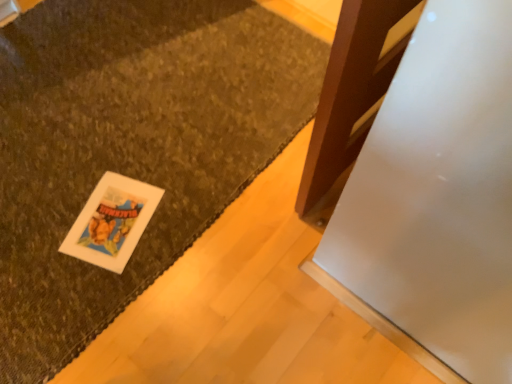
Question: Looking at the image, does white matte card at lower left seem bigger or smaller compared to textured brown mat at lower left?

Choices:
 (A) big
 (B) small

Answer: (B)

Question: Is white matte card at lower left to the left or to the right of textured brown mat at lower left in the image?

Choices:
 (A) right
 (B) left

Answer: (A)

Question: From the image's perspective, relative to textured brown mat at lower left, is white matte card at lower left above or below?

Choices:
 (A) above
 (B) below

Answer: (B)

Question: Considering the relative positions of textured brown mat at lower left and white matte card at lower left in the image provided, is textured brown mat at lower left to the left or to the right of white matte card at lower left?

Choices:
 (A) left
 (B) right

Answer: (A)

Question: Based on their sizes in the image, would you say textured brown mat at lower left is bigger or smaller than white matte card at lower left?

Choices:
 (A) big
 (B) small

Answer: (A)

Question: Is point (304, 94) positioned closer to the camera than point (123, 236)?

Choices:
 (A) closer
 (B) farther

Answer: (B)

Question: From the image's perspective, is textured brown mat at lower left above or below white matte card at lower left?

Choices:
 (A) below
 (B) above

Answer: (B)